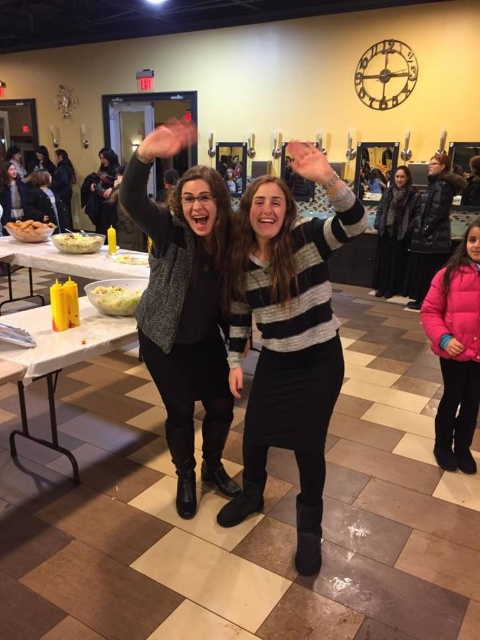
Which of these two, golden fried chicken at lower left or yellow plastic container at center, stands shorter?

yellow plastic container at center

Based on the photo, how far apart are golden fried chicken at lower left and yellow plastic container at center?

A distance of 3.52 feet exists between golden fried chicken at lower left and yellow plastic container at center.

The width and height of the screenshot is (480, 640). I want to click on golden fried chicken at lower left, so click(x=29, y=230).

At what (x,y) coordinates should I click in order to perform the action: click on golden fried chicken at lower left. Please return your answer as a coordinate pair (x, y). Image resolution: width=480 pixels, height=640 pixels. Looking at the image, I should click on (29, 230).

Can you confirm if striped sweater at center is positioned to the left of white creamy salad at center?

In fact, striped sweater at center is to the right of white creamy salad at center.

Can you confirm if striped sweater at center is positioned below white creamy salad at center?

Yes.

This screenshot has height=640, width=480. Describe the element at coordinates (288, 337) in the screenshot. I see `striped sweater at center` at that location.

Where is `striped sweater at center`? The height and width of the screenshot is (640, 480). striped sweater at center is located at coordinates (288, 337).

Who is higher up, matte black jacket at upper left or white creamy salad at left?

matte black jacket at upper left

Is matte black jacket at upper left wider than white creamy salad at left?

Yes, matte black jacket at upper left is wider than white creamy salad at left.

Where is `matte black jacket at upper left`? This screenshot has height=640, width=480. matte black jacket at upper left is located at coordinates (11, 193).

Find the location of `matte black jacket at upper left`. matte black jacket at upper left is located at coordinates (11, 193).